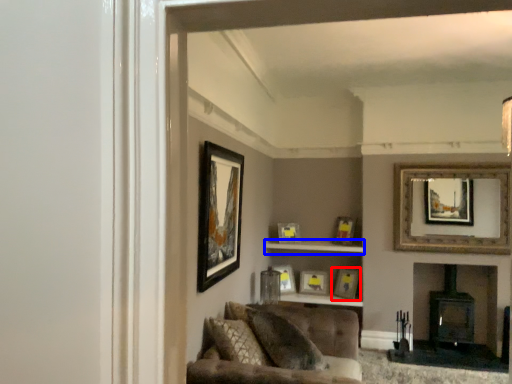
Question: Among these objects, which one is farthest to the camera, picture frame (highlighted by a red box) or cabinet (highlighted by a blue box)?

Choices:
 (A) picture frame
 (B) cabinet

Answer: (A)